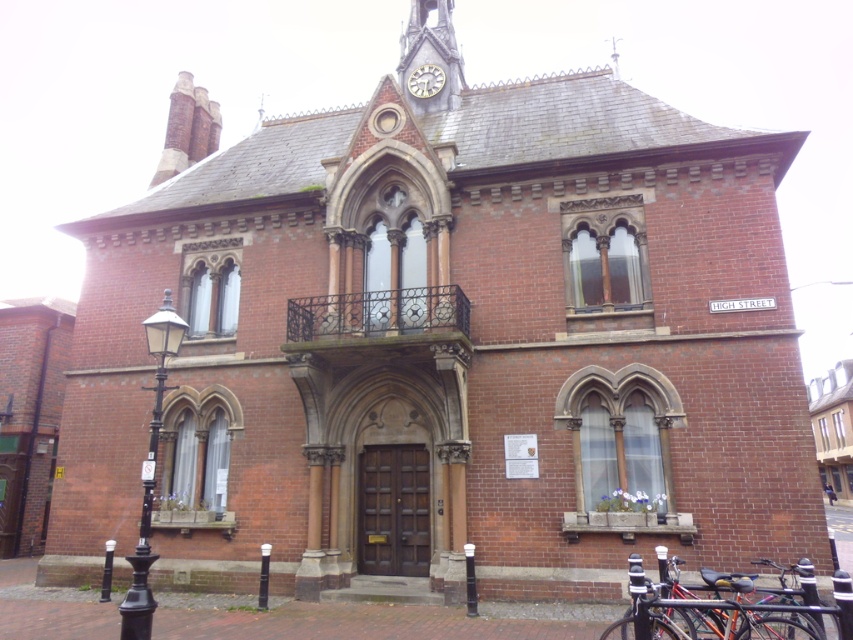
Question: Which object appears farthest from the camera in this image?

Choices:
 (A) gold metallic clock at upper center
 (B) shiny black bicycle at lower right

Answer: (A)

Question: Does shiny black bicycle at lower right have a lesser width compared to gold metallic clock at upper center?

Choices:
 (A) yes
 (B) no

Answer: (B)

Question: Does shiny black bicycle at lower right appear on the right side of gold metallic clock at upper center?

Choices:
 (A) yes
 (B) no

Answer: (A)

Question: Can you confirm if shiny black bicycle at lower right is positioned above gold metallic clock at upper center?

Choices:
 (A) yes
 (B) no

Answer: (B)